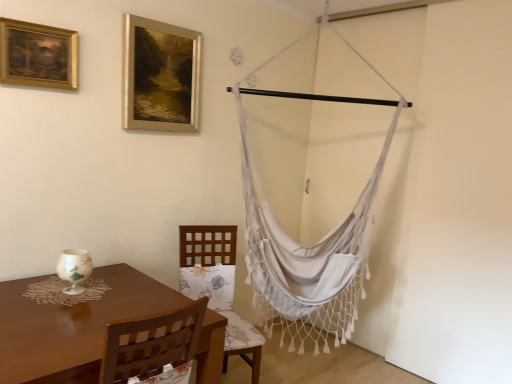
Question: Is gold metallic picture frame at upper center, which ranks as the second picture frame in left-to-right order, facing towards woodenchair at center?

Choices:
 (A) no
 (B) yes

Answer: (A)

Question: Considering the relative positions of gold metallic picture frame at upper center, which is counted as the second picture frame, starting from the front, and woodenchair at center in the image provided, is gold metallic picture frame at upper center, which is counted as the second picture frame, starting from the front, in front of woodenchair at center?

Choices:
 (A) yes
 (B) no

Answer: (B)

Question: Is gold metallic picture frame at upper center, which appears as the 1th picture frame when viewed from the back, placed right next to woodenchair at center?

Choices:
 (A) no
 (B) yes

Answer: (A)

Question: Considering the relative sizes of gold metallic picture frame at upper center, which is counted as the second picture frame, starting from the front, and woodenchair at center in the image provided, is gold metallic picture frame at upper center, which is counted as the second picture frame, starting from the front, shorter than woodenchair at center?

Choices:
 (A) yes
 (B) no

Answer: (A)

Question: Does gold metallic picture frame at upper center, placed as the first picture frame when sorted from right to left, lie behind woodenchair at center?

Choices:
 (A) no
 (B) yes

Answer: (B)

Question: From the image's perspective, is gold metallic picture frame at upper center, which is counted as the second picture frame, starting from the front, beneath woodenchair at center?

Choices:
 (A) yes
 (B) no

Answer: (B)

Question: Is brown wooden table at lower left to the right of white macrame hammock at right from the viewer's perspective?

Choices:
 (A) yes
 (B) no

Answer: (B)

Question: Does brown wooden table at lower left have a greater width compared to white macrame hammock at right?

Choices:
 (A) no
 (B) yes

Answer: (B)

Question: Does brown wooden table at lower left have a lesser height compared to white macrame hammock at right?

Choices:
 (A) no
 (B) yes

Answer: (B)

Question: From a real-world perspective, is brown wooden table at lower left under white macrame hammock at right?

Choices:
 (A) yes
 (B) no

Answer: (A)

Question: From the image's perspective, is brown wooden table at lower left on top of white macrame hammock at right?

Choices:
 (A) no
 (B) yes

Answer: (A)

Question: Is brown wooden table at lower left positioned far away from white macrame hammock at right?

Choices:
 (A) yes
 (B) no

Answer: (A)

Question: Is gold metallic picture frame at upper center, which appears as the 1th picture frame when viewed from the back, to the right of brown wooden table at lower left from the viewer's perspective?

Choices:
 (A) no
 (B) yes

Answer: (B)